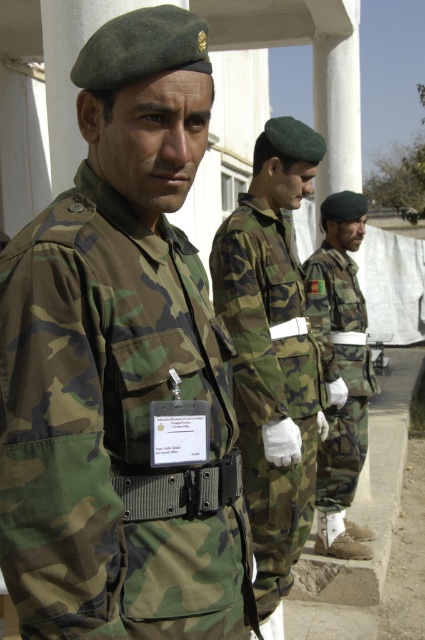
Question: Which point is farther to the camera?

Choices:
 (A) camouflage fabric uniform at center
 (B) camo uniform at center

Answer: (A)

Question: Can you confirm if camo uniform at center is smaller than camouflage fabric uniform at center?

Choices:
 (A) no
 (B) yes

Answer: (B)

Question: Is camo uniform at center positioned in front of camouflage fabric uniform at center?

Choices:
 (A) yes
 (B) no

Answer: (A)

Question: Can you confirm if camo uniform at center is thinner than camo fabric uniform at center?

Choices:
 (A) no
 (B) yes

Answer: (B)

Question: Estimate the real-world distances between objects in this image. Which object is closer to the camo uniform at center?

Choices:
 (A) camo fabric uniform at center
 (B) camouflage fabric uniform at center

Answer: (B)

Question: Which object appears closest to the camera in this image?

Choices:
 (A) camo uniform at center
 (B) camouflage fabric uniform at center
 (C) camo fabric uniform at center

Answer: (A)